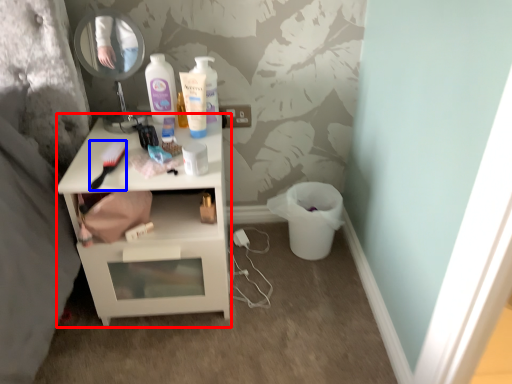
Question: Which of the following is the closest to the observer, nightstand (highlighted by a red box) or brush (highlighted by a blue box)?

Choices:
 (A) nightstand
 (B) brush

Answer: (B)